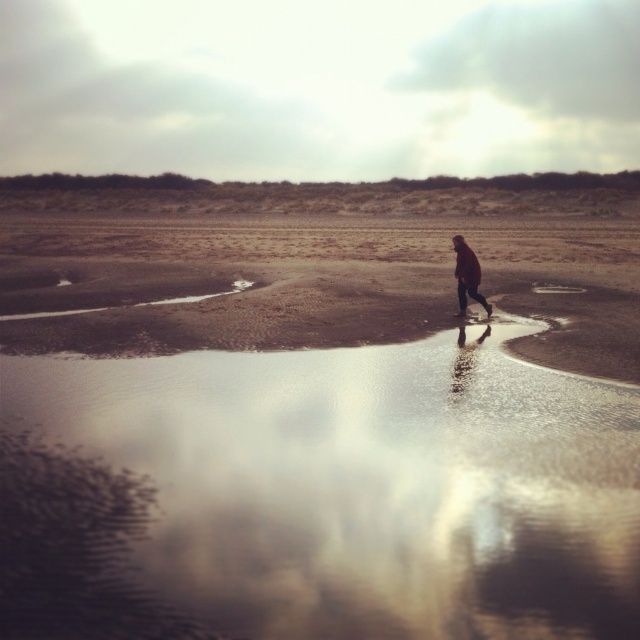
Does glossy reflective water at center appear on the left side of matte brown coat at center?

Correct, you'll find glossy reflective water at center to the left of matte brown coat at center.

Is the position of glossy reflective water at center more distant than that of matte brown coat at center?

No, it is in front of matte brown coat at center.

Identify the location of glossy reflective water at center. (317, 493).

The width and height of the screenshot is (640, 640). What do you see at coordinates (467, 275) in the screenshot?
I see `matte brown coat at center` at bounding box center [467, 275].

Does matte brown coat at center appear on the left side of glossy reflective puddle at center?

Yes, matte brown coat at center is to the left of glossy reflective puddle at center.

Is point (456, 276) closer to viewer compared to point (573, 289)?

Yes, it is.

You are a GUI agent. You are given a task and a screenshot of the screen. Output one action in this format:
    pyautogui.click(x=<x>, y=<y>)
    Task: Click on the matte brown coat at center
    This screenshot has height=640, width=640.
    Given the screenshot: What is the action you would take?
    pyautogui.click(x=467, y=275)

Image resolution: width=640 pixels, height=640 pixels. What do you see at coordinates (317, 493) in the screenshot?
I see `glossy reflective water at center` at bounding box center [317, 493].

Which is more to the right, glossy reflective water at center or glossy reflective puddle at center?

glossy reflective puddle at center is more to the right.

Is point (17, 467) less distant than point (540, 288)?

Yes, it is in front of point (540, 288).

The image size is (640, 640). In order to click on glossy reflective water at center in this screenshot , I will do `click(317, 493)`.